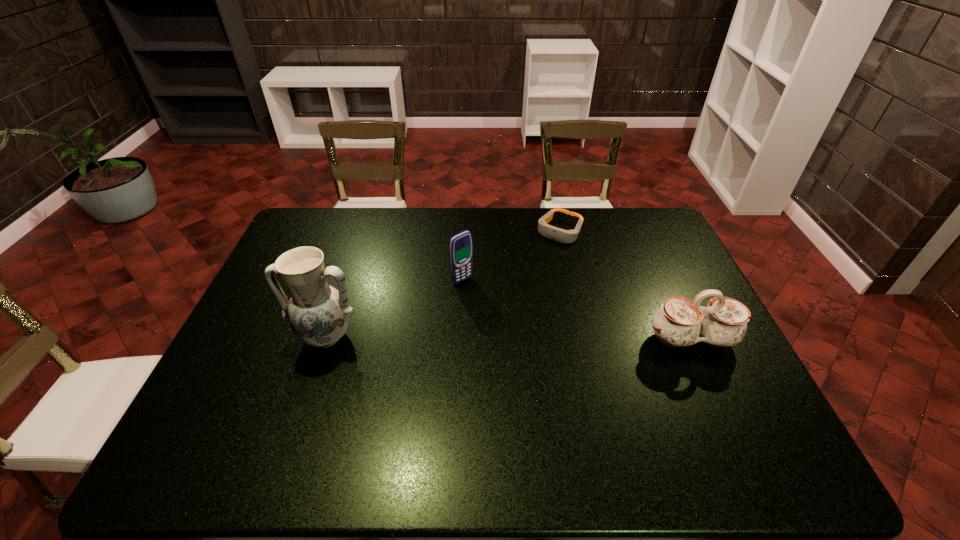
Find the location of a particular element. The width and height of the screenshot is (960, 540). the tallest object is located at coordinates (318, 314).

The width and height of the screenshot is (960, 540). What are the coordinates of `the leftmost object` in the screenshot? It's located at (318, 314).

Find the location of a particular element. The image size is (960, 540). chinaware is located at coordinates (680, 322).

Identify the location of the shortest object. The image size is (960, 540). (565, 236).

This screenshot has width=960, height=540. I want to click on goggles, so click(x=565, y=236).

Where is `the third nearest object`? The width and height of the screenshot is (960, 540). the third nearest object is located at coordinates (460, 246).

The height and width of the screenshot is (540, 960). Identify the location of cellular telephone. (460, 246).

Find the location of a particular element. This screenshot has width=960, height=540. free space located on either side of the pottery is located at coordinates (300, 413).

You are a GUI agent. You are given a task and a screenshot of the screen. Output one action in this format:
    pyautogui.click(x=<x>, y=<y>)
    Task: Click on the vacant space located by the handle of the chinaware
    The height and width of the screenshot is (540, 960).
    Given the screenshot: What is the action you would take?
    pyautogui.click(x=730, y=423)

You are a GUI agent. You are given a task and a screenshot of the screen. Output one action in this format:
    pyautogui.click(x=<x>, y=<y>)
    Task: Click on the free space located 0.320m on the front and back of the goggles
    This screenshot has height=540, width=960.
    Given the screenshot: What is the action you would take?
    pyautogui.click(x=508, y=301)